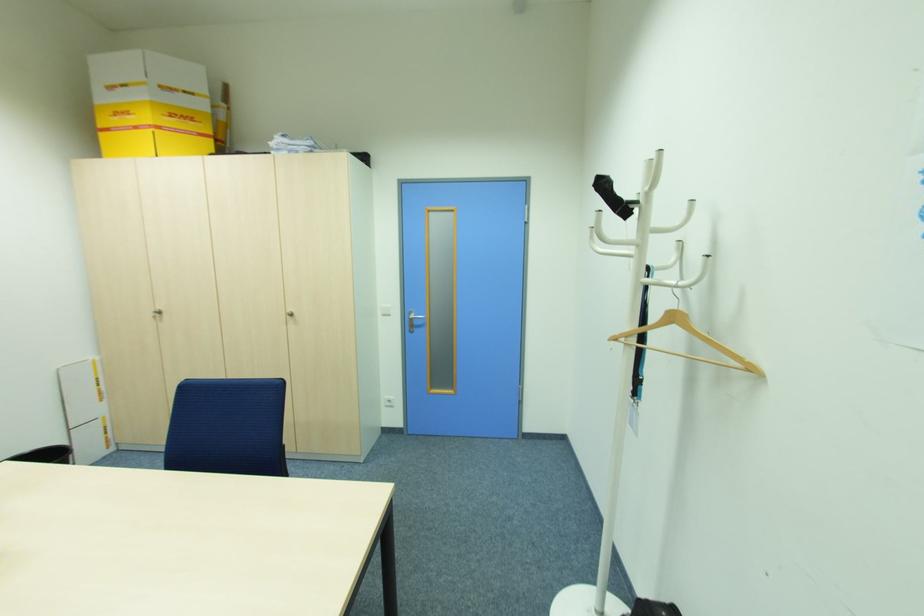
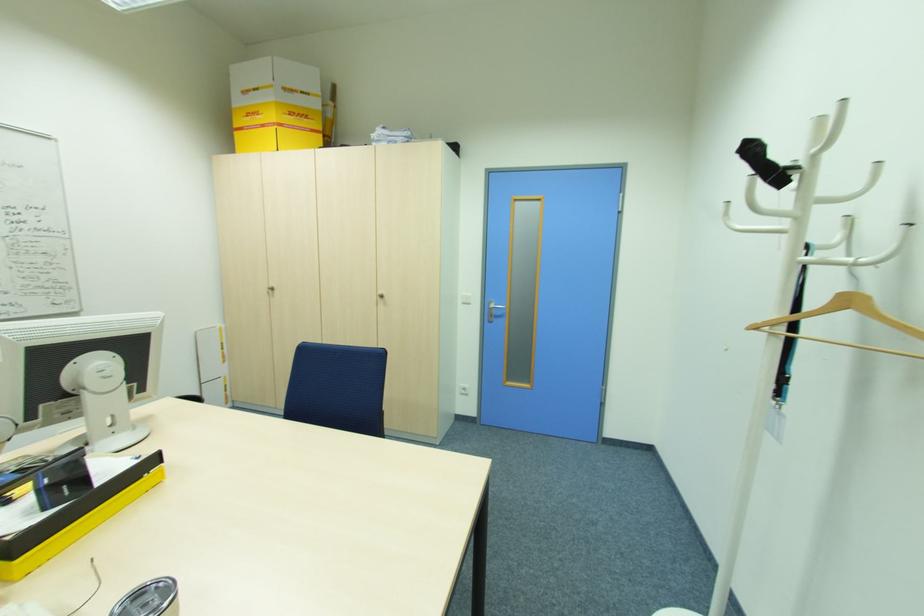
Question: The images are taken continuously from a first-person perspective. In which direction are you moving?

Choices:
 (A) Left
 (B) Right
 (C) Forward
 (D) Backward

Answer: (A)